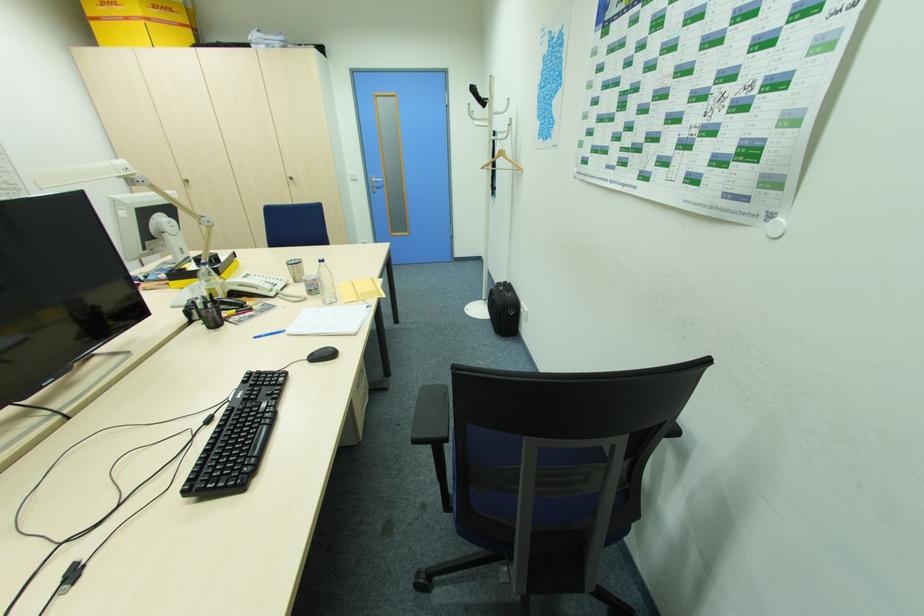
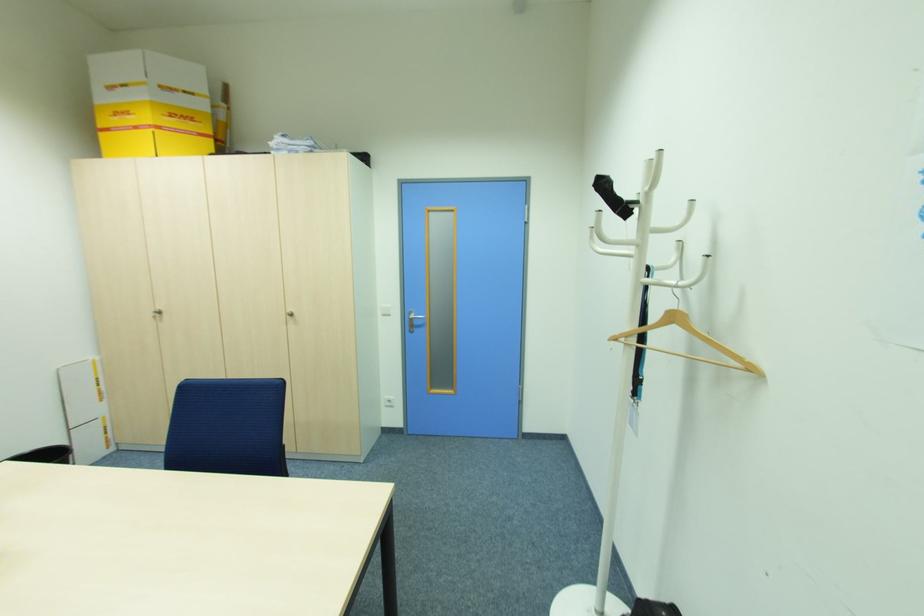
Locate, in the second image, the point that corresponds to the point at 377,188 in the first image.

(415, 325)